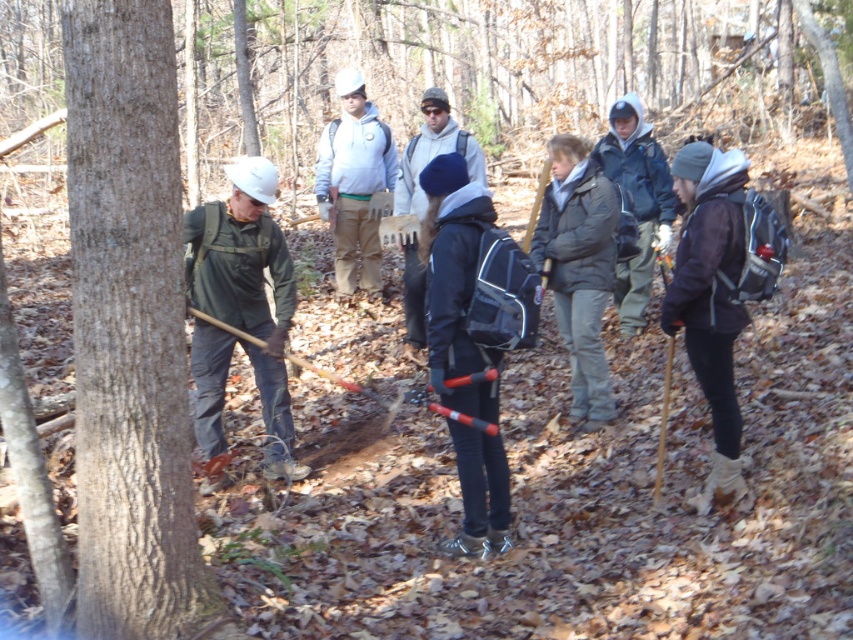
Question: Which object appears farthest from the camera in this image?

Choices:
 (A) brown fabric backpack at lower right
 (B) white matte hard hat at center
 (C) dark blue fleece jacket at center
 (D) matte black backpack at center

Answer: (B)

Question: Which point appears closest to the camera in this image?

Choices:
 (A) (425, 141)
 (B) (212, 248)
 (C) (639, 150)
 (D) (738, 288)

Answer: (D)

Question: Does dark blue jacket at center appear on the right side of dark blue fleece jacket at center?

Choices:
 (A) yes
 (B) no

Answer: (A)

Question: Which of the following is the closest to the observer?

Choices:
 (A) (131, 506)
 (B) (242, 216)

Answer: (A)

Question: Does green matte jacket at left come behind white matte hard hat at center?

Choices:
 (A) no
 (B) yes

Answer: (A)

Question: Does matte black backpack at center appear over dark blue fleece jacket at center?

Choices:
 (A) yes
 (B) no

Answer: (B)